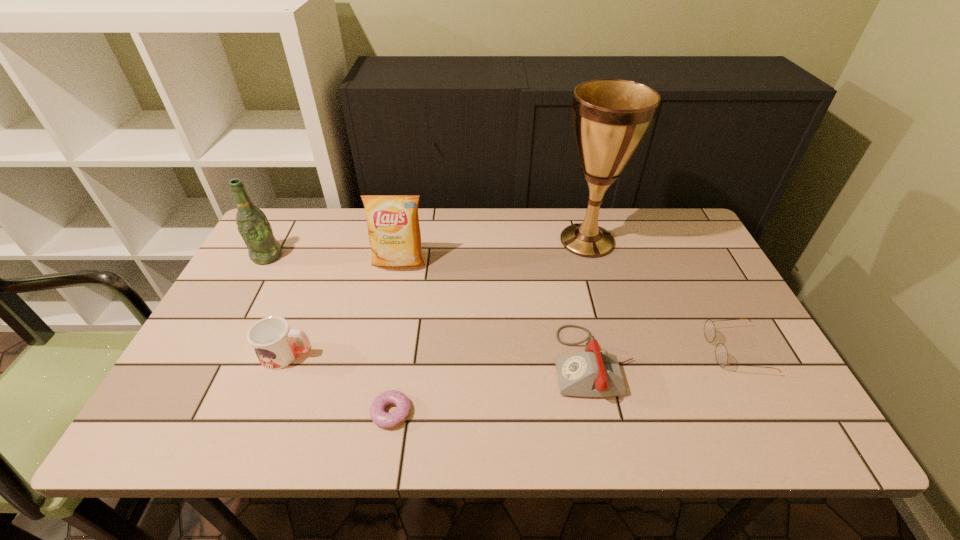
Locate an element on the screen. Image resolution: width=960 pixels, height=540 pixels. vacant space situated on the front of the trophy cup is located at coordinates (611, 323).

This screenshot has height=540, width=960. I want to click on free space located 0.180m on the surface of the leftmost object, so click(x=236, y=312).

This screenshot has height=540, width=960. Identify the location of free space located 0.190m on the front-facing side of the third tallest object. (386, 324).

At what (x,y) coordinates should I click in order to perform the action: click on blank area located on the side of the fourth tallest object with the handle. Please return your answer as a coordinate pair (x, y). This screenshot has width=960, height=540. Looking at the image, I should click on (360, 355).

Locate an element on the screen. The width and height of the screenshot is (960, 540). vacant space located 0.340m on the dial of the telephone is located at coordinates (408, 362).

Image resolution: width=960 pixels, height=540 pixels. I want to click on vacant space positioned on the dial of the telephone, so click(443, 362).

Find the location of a particular element. Image resolution: width=960 pixels, height=540 pixels. vacant space located 0.270m on the dial of the telephone is located at coordinates (439, 362).

The height and width of the screenshot is (540, 960). I want to click on free location located on the temples of the spectacles, so click(x=545, y=350).

Locate an element on the screen. The image size is (960, 540). blank space located 0.230m on the temples of the spectacles is located at coordinates (612, 350).

Locate an element on the screen. vacant region located on the temples of the spectacles is located at coordinates (684, 350).